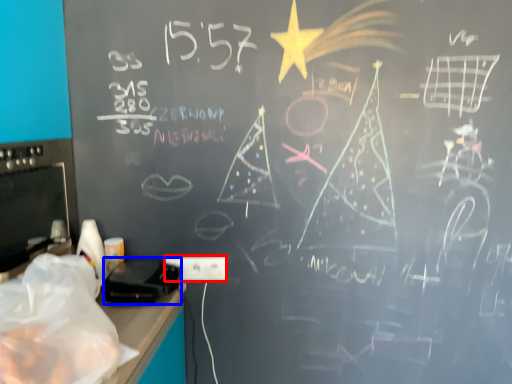
Question: Which point is further to the camera, electric outlet (highlighted by a red box) or equipment (highlighted by a blue box)?

Choices:
 (A) electric outlet
 (B) equipment

Answer: (A)